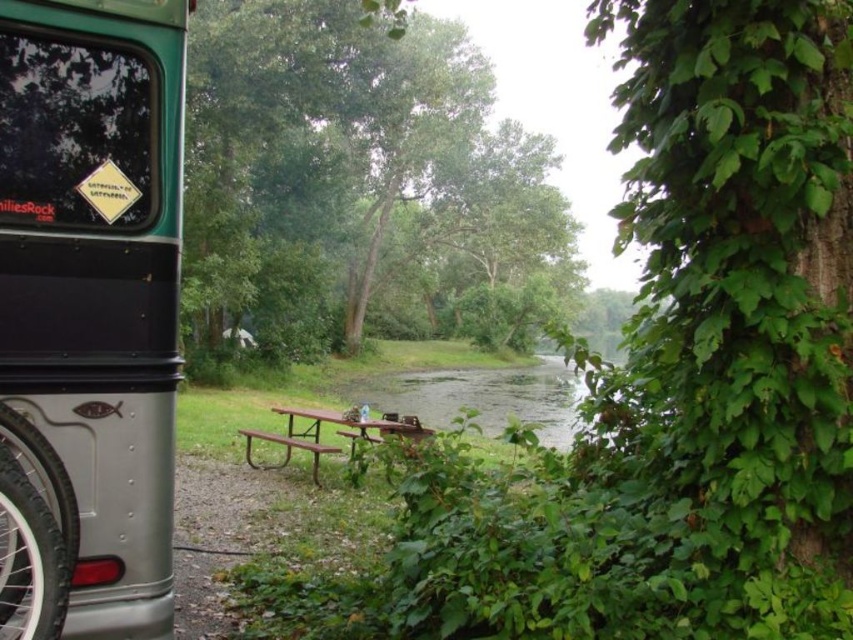
Who is taller, green leafy tree at center or brown metal picnic table at center?

With more height is green leafy tree at center.

What do you see at coordinates (355, 168) in the screenshot? This screenshot has width=853, height=640. I see `green leafy tree at center` at bounding box center [355, 168].

Is point (238, 81) behind point (393, 419)?

Yes, point (238, 81) is behind point (393, 419).

Where is `green leafy tree at center`? green leafy tree at center is located at coordinates (355, 168).

Does green leafy tree at center have a larger size compared to metallic silver recreational vehicle at left?

Yes, green leafy tree at center is bigger than metallic silver recreational vehicle at left.

Who is positioned more to the left, green leafy tree at center or metallic silver recreational vehicle at left?

metallic silver recreational vehicle at left is more to the left.

Which is in front, point (318, 209) or point (70, 106)?

Positioned in front is point (70, 106).

The image size is (853, 640). What are the coordinates of `green leafy tree at center` in the screenshot? It's located at (355, 168).

Between metallic silver recreational vehicle at left and brown metal picnic table at center, which one has less height?

Standing shorter between the two is brown metal picnic table at center.

Does point (160, 81) lie behind point (425, 432)?

No, it is not.

Where is `metallic silver recreational vehicle at left`? metallic silver recreational vehicle at left is located at coordinates (97, 280).